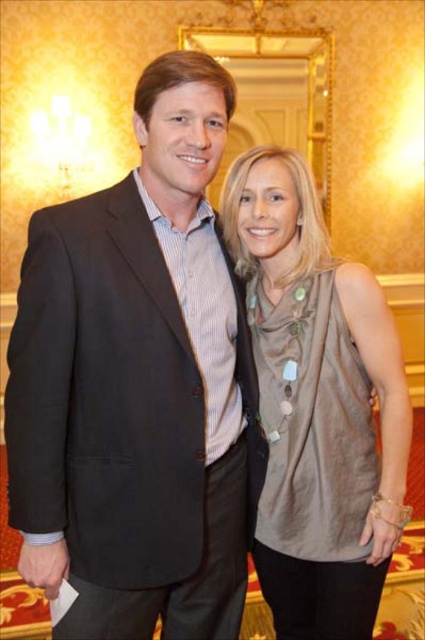
Question: Among these points, which one is nearest to the camera?

Choices:
 (A) (155, 77)
 (B) (394, 368)

Answer: (A)

Question: Is the position of matte black suit at left more distant than that of satin beige top at center?

Choices:
 (A) yes
 (B) no

Answer: (B)

Question: Which point appears closest to the camera in this image?

Choices:
 (A) (271, 554)
 (B) (149, 330)

Answer: (B)

Question: Does matte black suit at left appear on the right side of satin beige top at center?

Choices:
 (A) yes
 (B) no

Answer: (B)

Question: Which point is farther to the camera?

Choices:
 (A) satin beige top at center
 (B) matte black suit at left

Answer: (A)

Question: Is matte black suit at left positioned in front of satin beige top at center?

Choices:
 (A) yes
 (B) no

Answer: (A)